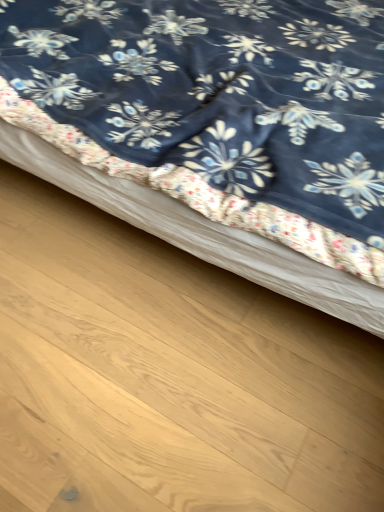
Describe the element at coordinates (215, 131) in the screenshot. I see `blue floral fabric at upper center` at that location.

What is the approximate width of blue floral fabric at upper center?

It is 5.35 feet.

Where is `blue floral fabric at upper center`? The width and height of the screenshot is (384, 512). blue floral fabric at upper center is located at coordinates (215, 131).

The height and width of the screenshot is (512, 384). What are the coordinates of `blue floral fabric at upper center` in the screenshot? It's located at (215, 131).